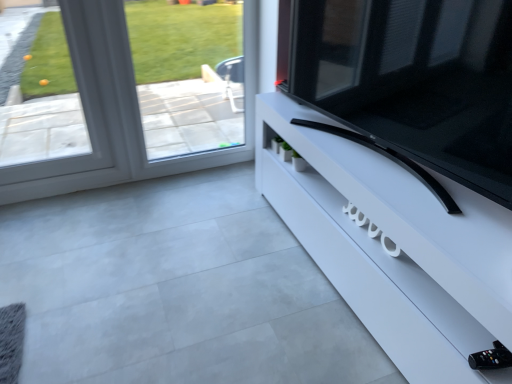
Question: From a real-world perspective, is clear glass window at upper left positioned above or below white glossy tv stand at right?

Choices:
 (A) above
 (B) below

Answer: (A)

Question: From the image's perspective, relative to white glossy tv stand at right, is clear glass window at upper left above or below?

Choices:
 (A) above
 (B) below

Answer: (A)

Question: Based on their relative distances, which object is farther from the clear glass window at upper left?

Choices:
 (A) white glossy tv stand at right
 (B) black glossy tv at right

Answer: (B)

Question: Which object is the closest to the black glossy tv at right?

Choices:
 (A) white glossy tv stand at right
 (B) clear glass window at upper left

Answer: (A)